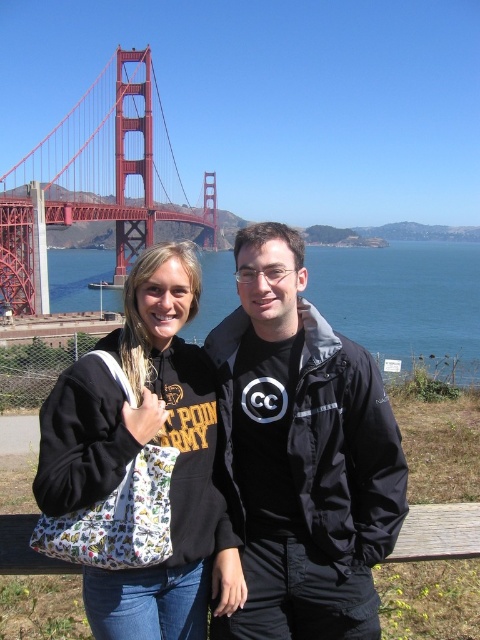
You are a photographer trying to capture a photo of the black matte jacket at center and the printed fabric tote bag at center. Which object is closer to your camera lens?

The black matte jacket at center is closer to the camera lens because it is further to the viewer than the printed fabric tote bag at center.